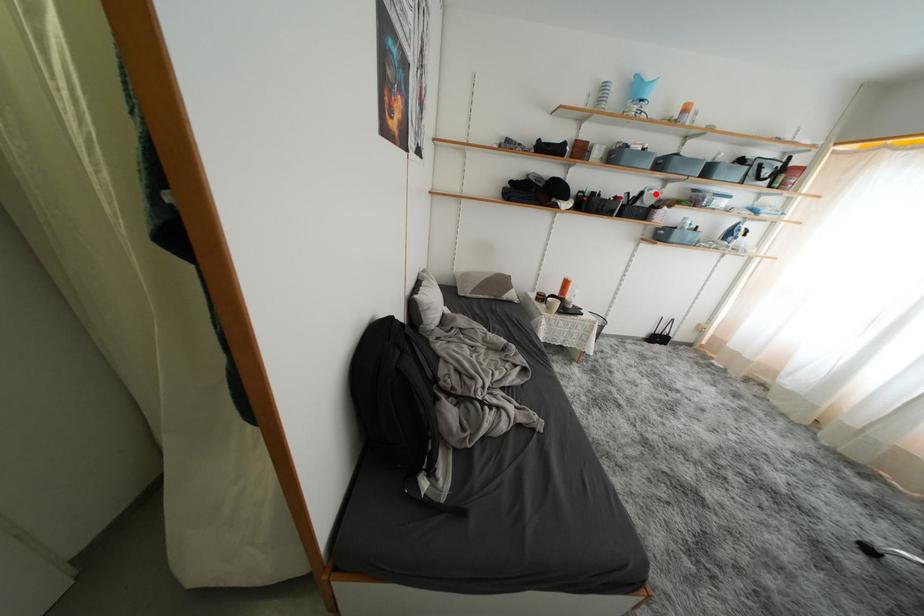
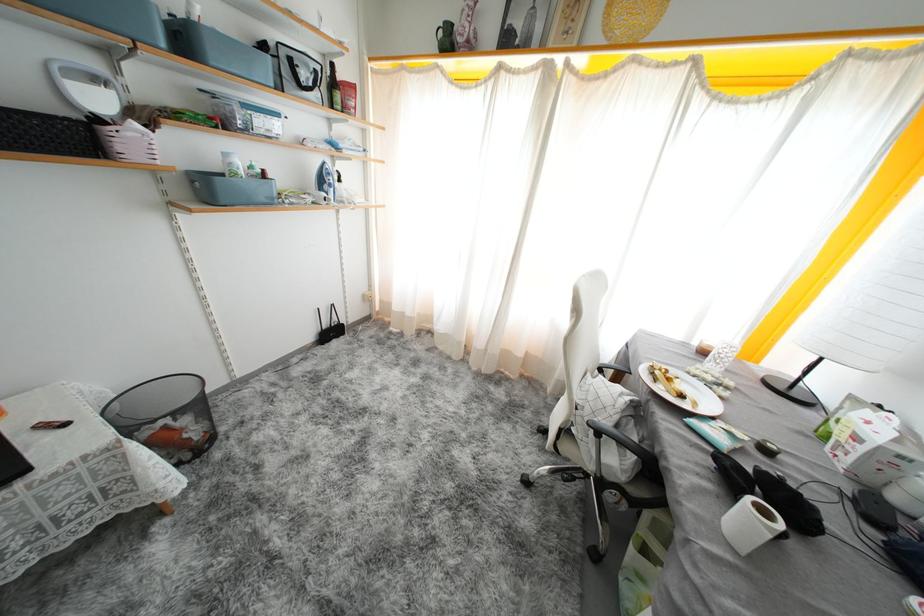
The point at the highlighted location is marked in the first image. Where is the corresponding point in the second image?

(103, 84)